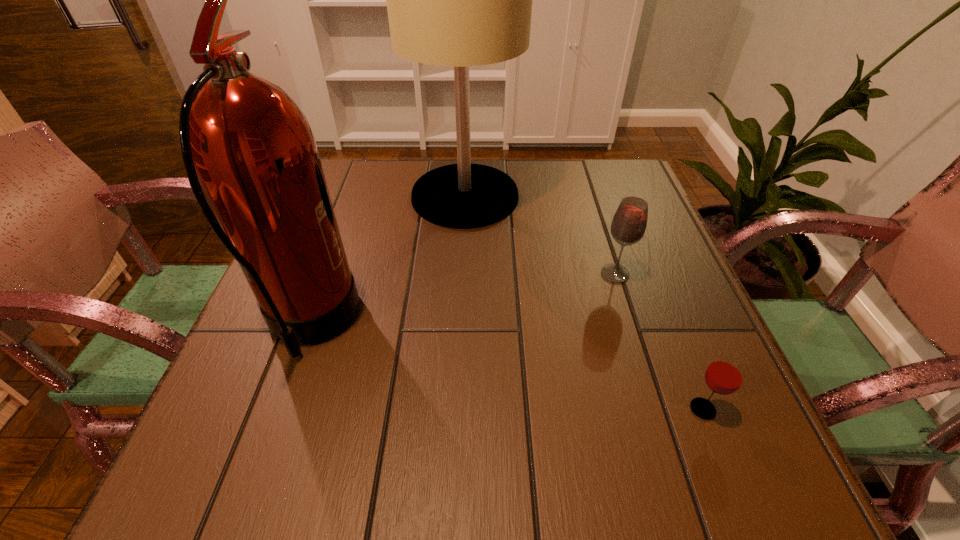
You are a GUI agent. You are given a task and a screenshot of the screen. Output one action in this format:
    pyautogui.click(x=<x>, y=<y>)
    Task: Click on the empty space that is in between the fire extinguisher and the nearest object
    The image size is (960, 540).
    Given the screenshot: What is the action you would take?
    pyautogui.click(x=506, y=367)

Locate an element on the screen. This screenshot has width=960, height=540. object that ranks as the closest to the nearest object is located at coordinates (628, 226).

Locate which object ranks second in proximity to the second object from left to right. Please provide its 2D coordinates. Your answer should be formatted as a tuple, i.e. [(x, y)], where the tuple contains the x and y coordinates of a point satisfying the conditions above.

[(628, 226)]

Find the location of `free space that satisfies the following two spatial constraints: 1. on the front side of the farther glass; 2. on the front-facing side of the leftmost object`. free space that satisfies the following two spatial constraints: 1. on the front side of the farther glass; 2. on the front-facing side of the leftmost object is located at coordinates (631, 324).

You are a GUI agent. You are given a task and a screenshot of the screen. Output one action in this format:
    pyautogui.click(x=<x>, y=<y>)
    Task: Click on the free space in the image that satisfies the following two spatial constraints: 1. on the front side of the farther glass; 2. on the front-facing side of the fire extinguisher
    The height and width of the screenshot is (540, 960).
    Given the screenshot: What is the action you would take?
    pyautogui.click(x=631, y=324)

Find the location of a particular element. The width and height of the screenshot is (960, 540). vacant space that satisfies the following two spatial constraints: 1. on the front side of the second shortest object; 2. on the left side of the second object from left to right is located at coordinates (462, 274).

The width and height of the screenshot is (960, 540). Identify the location of free space that satisfies the following two spatial constraints: 1. on the back side of the shorter glass; 2. on the front-facing side of the fire extinguisher. (669, 324).

Find the location of a particular element. vacant space that satisfies the following two spatial constraints: 1. on the front side of the farthest object; 2. on the front-facing side of the leftmost object is located at coordinates (460, 324).

You are a GUI agent. You are given a task and a screenshot of the screen. Output one action in this format:
    pyautogui.click(x=<x>, y=<y>)
    Task: Click on the free space that satisfies the following two spatial constraints: 1. on the back side of the nearest object; 2. on the front-facing side of the leftmost object
    The image size is (960, 540).
    Given the screenshot: What is the action you would take?
    pyautogui.click(x=669, y=324)